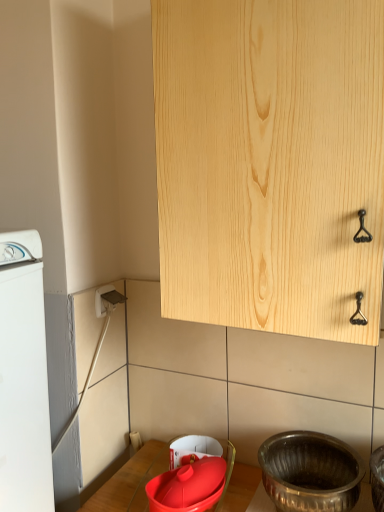
Question: Is point (278, 500) closer or farther from the camera than point (281, 138)?

Choices:
 (A) closer
 (B) farther

Answer: (B)

Question: In the image, is polished silver basin at lower right, marked as the first basin in a right-to-left arrangement, positioned in front of or behind natural wood cabinet at upper center?

Choices:
 (A) front
 (B) behind

Answer: (B)

Question: Estimate the real-world distances between objects in this image. Which object is farther from the matte red basin at lower center, positioned as the second basin in right-to-left order?

Choices:
 (A) white plastic washing machine at left
 (B) polished silver basin at lower right, marked as the first basin in a right-to-left arrangement
 (C) natural wood cabinet at upper center
 (D) white plastic electric outlet at lower left

Answer: (C)

Question: Which is farther from the natural wood cabinet at upper center?

Choices:
 (A) matte red basin at lower center, the first basin from the left
 (B) polished silver basin at lower right, marked as the first basin in a right-to-left arrangement
 (C) white plastic electric outlet at lower left
 (D) white plastic washing machine at left

Answer: (A)